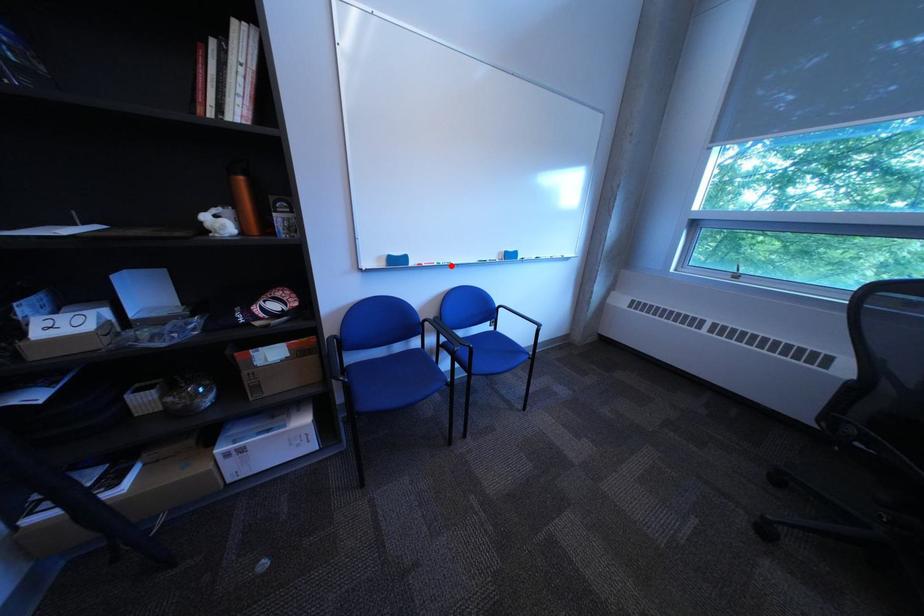
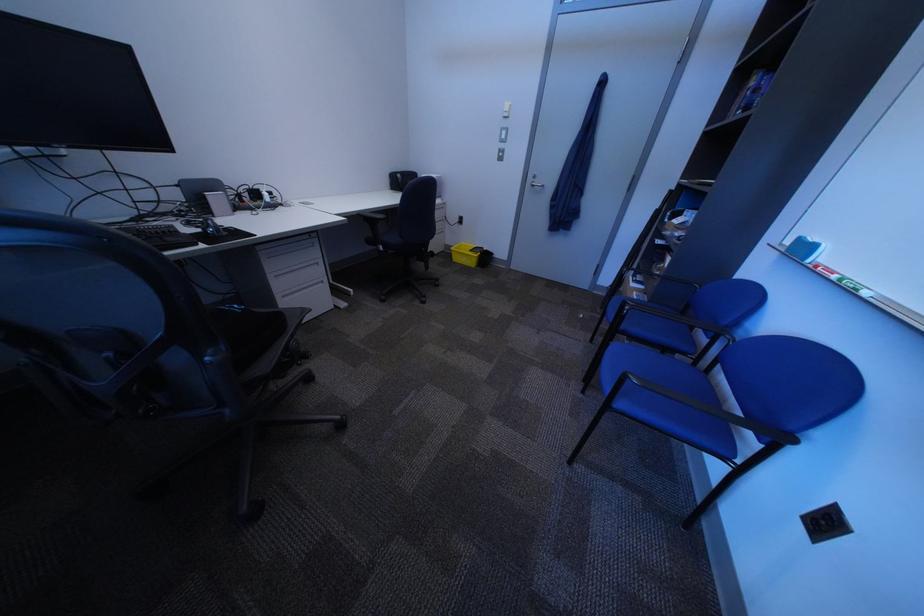
Question: I am providing you with two images of the same scene from different viewpoints. A red point is marked on the first image. At the location where the point appears in image 1, is it still visible in image 2?

Choices:
 (A) Yes
 (B) No

Answer: (A)